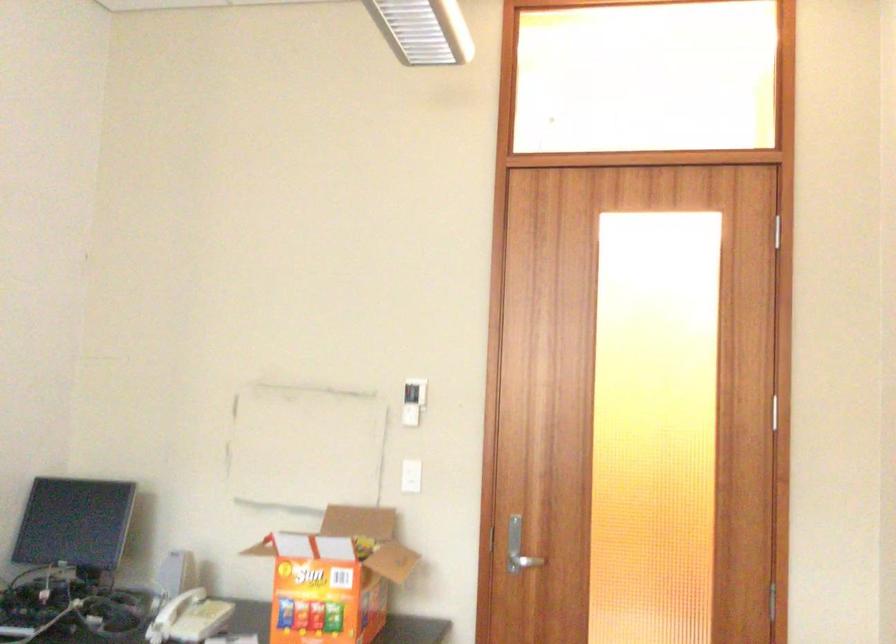
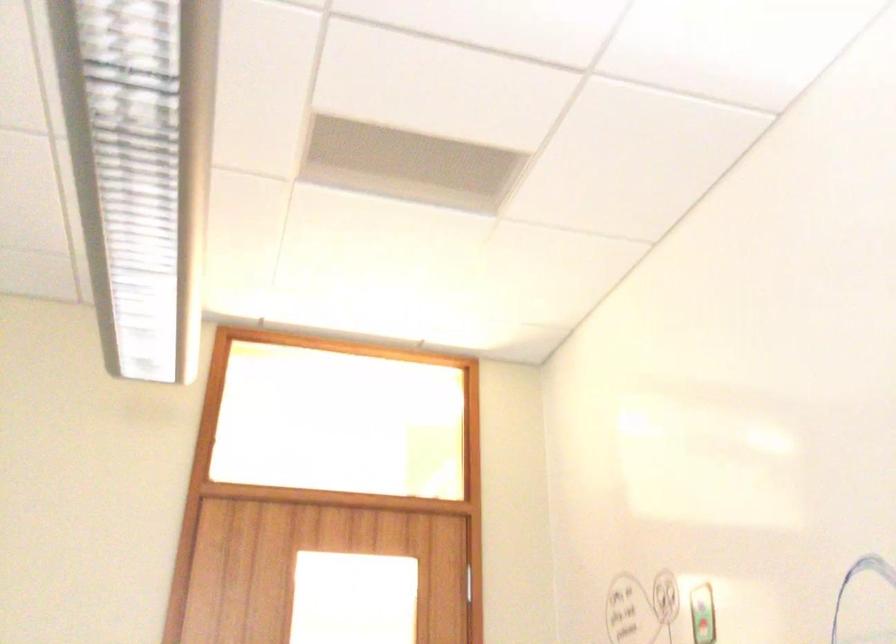
First-person continuous shooting, in which direction is the camera rotating?

The camera rotated toward right-up.